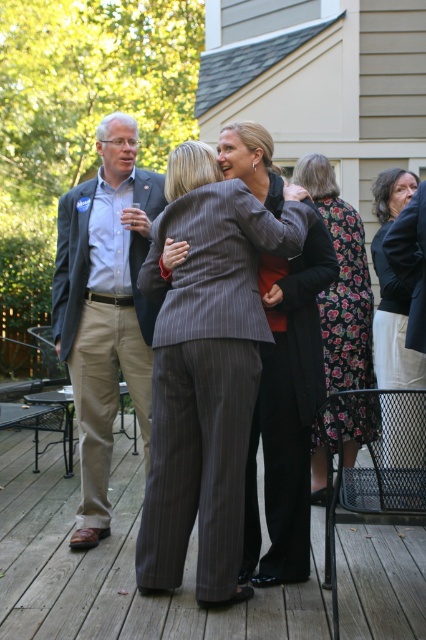
Which is more to the right, wooden deck at center or floral fabric dress at lower right?

From the viewer's perspective, floral fabric dress at lower right appears more on the right side.

Which is behind, point (385, 627) or point (420, 403)?

The point (420, 403) is behind.

Who is more forward, (x=298, y=596) or (x=382, y=250)?

Point (x=298, y=596) is more forward.

Find the location of a particular element. Image resolution: width=426 pixels, height=640 pixels. wooden deck at center is located at coordinates (118, 566).

I want to click on pinstriped fabric suit at center, so click(206, 371).

Is point (204, 406) positioned in front of point (135, 241)?

Yes, point (204, 406) is closer to viewer.

The width and height of the screenshot is (426, 640). What are the coordinates of `pinstriped fabric suit at center` in the screenshot? It's located at (206, 371).

Can you confirm if wooden deck at center is positioned below gray pinstripe suit at center?

Yes, wooden deck at center is below gray pinstripe suit at center.

Consider the image. Is wooden deck at center shorter than gray pinstripe suit at center?

Yes, wooden deck at center is shorter than gray pinstripe suit at center.

Between point (112, 472) and point (299, 356), which one is positioned in front?

Point (299, 356) is more forward.

Find the location of a particular element. wooden deck at center is located at coordinates (118, 566).